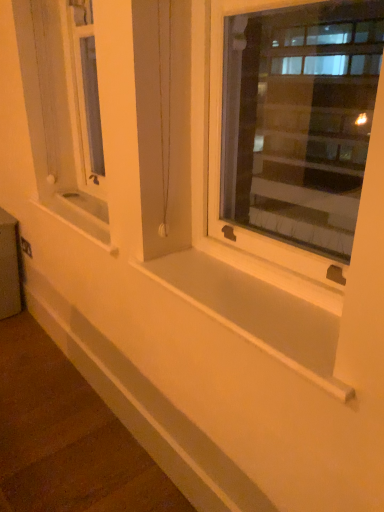
Find the location of a particular element. free space above white smooth window sill at center, the second window sill positioned from the bottom (from a real-world perspective) is located at coordinates (77, 196).